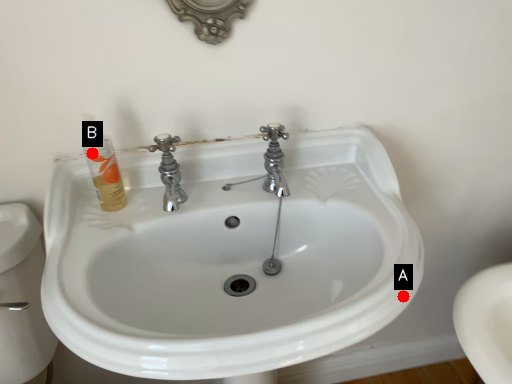
Question: Two points are circled on the image, labeled by A and B beside each circle. Which point appears farthest from the camera in this image?

Choices:
 (A) A is further
 (B) B is further

Answer: (B)